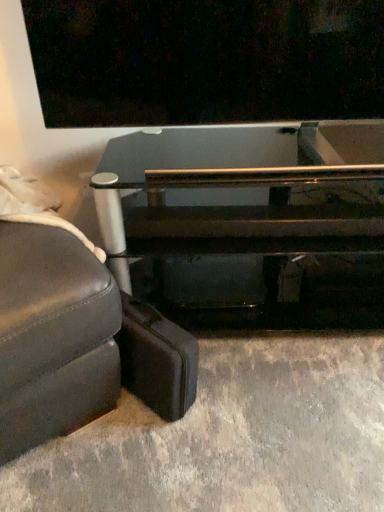
What do you see at coordinates (157, 360) in the screenshot? The image size is (384, 512). I see `leather suitcase at lower left` at bounding box center [157, 360].

Where is `transparent glass table at center`? transparent glass table at center is located at coordinates (250, 223).

How different are the orientations of leather studio couch at lower left and transparent glass table at center in degrees?

There is a 38.5-degree angle between the facing directions of leather studio couch at lower left and transparent glass table at center.

Does leather studio couch at lower left have a greater width compared to transparent glass table at center?

Yes, leather studio couch at lower left is wider than transparent glass table at center.

From their relative heights in the image, would you say leather studio couch at lower left is taller or shorter than transparent glass table at center?

Clearly, leather studio couch at lower left is shorter compared to transparent glass table at center.

From the image's perspective, which one is positioned lower, leather studio couch at lower left or transparent glass table at center?

leather studio couch at lower left appears lower in the image.

Which of these two, transparent glass table at center or leather suitcase at lower left, is bigger?

Bigger between the two is transparent glass table at center.

From a real-world perspective, is transparent glass table at center positioned above or below leather suitcase at lower left?

transparent glass table at center is situated higher than leather suitcase at lower left in the real world.

Is transparent glass table at center to the left or to the right of leather suitcase at lower left in the image?

transparent glass table at center is positioned on leather suitcase at lower left's right side.

Between leather studio couch at lower left and leather suitcase at lower left, which one appears on the right side from the viewer's perspective?

leather suitcase at lower left.

Is leather studio couch at lower left thinner than leather suitcase at lower left?

No, leather studio couch at lower left is not thinner than leather suitcase at lower left.

In the scene shown: From a real-world perspective, is leather studio couch at lower left located higher than leather suitcase at lower left?

Yes.

Is leather studio couch at lower left aimed at leather suitcase at lower left?

No, leather studio couch at lower left does not turn towards leather suitcase at lower left.

Is transparent glass table at center located outside leather studio couch at lower left?

transparent glass table at center is positioned outside leather studio couch at lower left.

Is transparent glass table at center not near leather studio couch at lower left?

No, transparent glass table at center is in close proximity to leather studio couch at lower left.

From a real-world perspective, does transparent glass table at center sit lower than leather studio couch at lower left?

Actually, transparent glass table at center is physically above leather studio couch at lower left in the real world.

Based on the photo, relative to leather studio couch at lower left, is transparent glass table at center in front or behind?

transparent glass table at center is behind leather studio couch at lower left.

Does leather suitcase at lower left have a smaller size compared to transparent glass table at center?

Indeed, leather suitcase at lower left has a smaller size compared to transparent glass table at center.

From the picture: What's the angular difference between leather suitcase at lower left and transparent glass table at center's facing directions?

45.6 degrees.

Is leather suitcase at lower left completely or partially outside of transparent glass table at center?

That's correct, leather suitcase at lower left is outside of transparent glass table at center.

Is leather suitcase at lower left with transparent glass table at center?

leather suitcase at lower left and transparent glass table at center are not in contact.

From their relative heights in the image, would you say leather suitcase at lower left is taller or shorter than leather studio couch at lower left?

leather suitcase at lower left is shorter than leather studio couch at lower left.

Consider the image. Is leather suitcase at lower left positioned in front of leather studio couch at lower left?

No, leather suitcase at lower left is behind leather studio couch at lower left.

Does leather suitcase at lower left have a lesser width compared to leather studio couch at lower left?

Yes, leather suitcase at lower left is thinner than leather studio couch at lower left.

Does point (159, 317) lie in front of point (111, 374)?

No, it is behind (111, 374).

This screenshot has width=384, height=512. I want to click on studio couch to the left of transparent glass table at center, so click(53, 336).

Image resolution: width=384 pixels, height=512 pixels. I want to click on luggage that is below the transparent glass table at center (from the image's perspective), so click(157, 360).

Based on their spatial positions, is transparent glass table at center or leather suitcase at lower left closer to leather studio couch at lower left?

leather suitcase at lower left is positioned closer to the anchor leather studio couch at lower left.

Based on their spatial positions, is transparent glass table at center or leather studio couch at lower left further from leather suitcase at lower left?

transparent glass table at center is further to leather suitcase at lower left.

Based on the photo, based on their spatial positions, is leather studio couch at lower left or transparent glass table at center further from leather suitcase at lower left?

transparent glass table at center.

From the image, which object appears to be farther from leather studio couch at lower left, leather suitcase at lower left or transparent glass table at center?

transparent glass table at center.

Looking at the image, which one is located further to transparent glass table at center, leather suitcase at lower left or leather studio couch at lower left?

leather studio couch at lower left is positioned further to the anchor transparent glass table at center.

Considering their positions, is leather studio couch at lower left positioned further to transparent glass table at center than leather suitcase at lower left?

leather studio couch at lower left is further to transparent glass table at center.

Find the location of a particular element. The height and width of the screenshot is (512, 384). luggage between leather studio couch at lower left and transparent glass table at center in the horizontal direction is located at coordinates (157, 360).